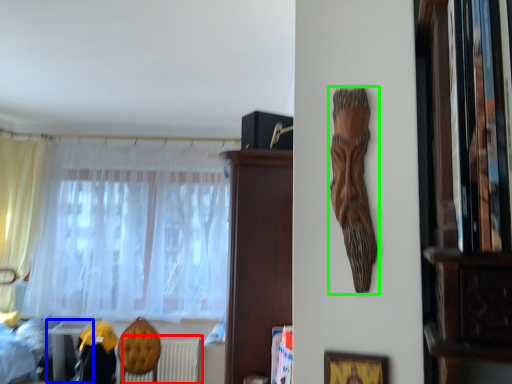
Question: Estimate the real-world distances between objects in this image. Which object is closer to radiator (highlighted by a red box), table (highlighted by a blue box) or person (highlighted by a green box)?

Choices:
 (A) table
 (B) person

Answer: (A)